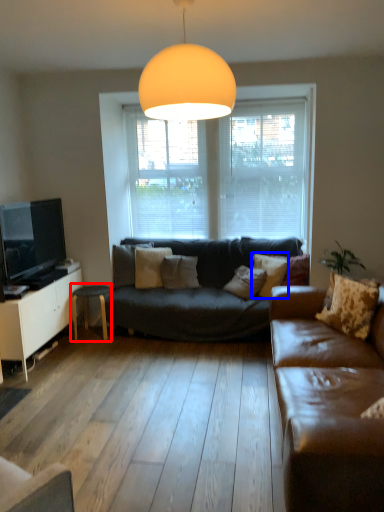
Question: Among these objects, which one is farthest to the camera, table (highlighted by a red box) or pillow (highlighted by a blue box)?

Choices:
 (A) table
 (B) pillow

Answer: (A)